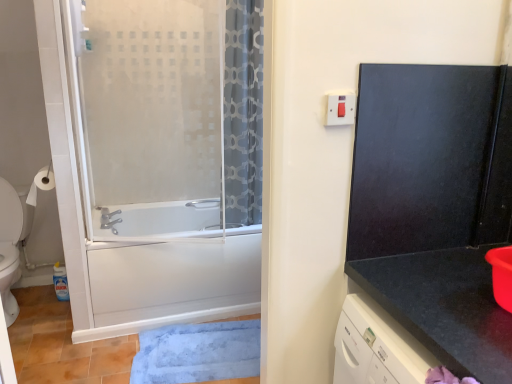
Question: Should I look upward or downward to see black granite countertop at right?

Choices:
 (A) down
 (B) up

Answer: (A)

Question: Is blue plush bath mat at lower center looking in the opposite direction of frosted glass screen door at left, which is the 2th screen door in right-to-left order?

Choices:
 (A) yes
 (B) no

Answer: (B)

Question: Can you confirm if blue plush bath mat at lower center is wider than frosted glass screen door at left, arranged as the first screen door when viewed from the left?

Choices:
 (A) no
 (B) yes

Answer: (B)

Question: From a real-world perspective, is blue plush bath mat at lower center located beneath frosted glass screen door at left, which is the 2th screen door in right-to-left order?

Choices:
 (A) yes
 (B) no

Answer: (A)

Question: Is blue plush bath mat at lower center further to the viewer compared to frosted glass screen door at left, which is the 2th screen door in right-to-left order?

Choices:
 (A) no
 (B) yes

Answer: (B)

Question: From the image's perspective, is blue plush bath mat at lower center located above frosted glass screen door at left, which is the 2th screen door in right-to-left order?

Choices:
 (A) no
 (B) yes

Answer: (A)

Question: Is blue plush bath mat at lower center shorter than frosted glass screen door at left, which is the 2th screen door in right-to-left order?

Choices:
 (A) no
 (B) yes

Answer: (B)

Question: Is black granite countertop at right not close to blue plush bath mat at lower center?

Choices:
 (A) no
 (B) yes

Answer: (B)

Question: Is black granite countertop at right shorter than blue plush bath mat at lower center?

Choices:
 (A) no
 (B) yes

Answer: (A)

Question: Can you confirm if black granite countertop at right is wider than blue plush bath mat at lower center?

Choices:
 (A) no
 (B) yes

Answer: (B)

Question: Is black granite countertop at right oriented towards blue plush bath mat at lower center?

Choices:
 (A) yes
 (B) no

Answer: (B)

Question: Does black granite countertop at right have a larger size compared to blue plush bath mat at lower center?

Choices:
 (A) yes
 (B) no

Answer: (A)

Question: From a real-world perspective, is black granite countertop at right positioned over blue plush bath mat at lower center based on gravity?

Choices:
 (A) yes
 (B) no

Answer: (A)

Question: Considering the relative sizes of frosted glass screen door at left, which is the 2th screen door in right-to-left order, and white glossy toilet at left in the image provided, is frosted glass screen door at left, which is the 2th screen door in right-to-left order, thinner than white glossy toilet at left?

Choices:
 (A) yes
 (B) no

Answer: (A)